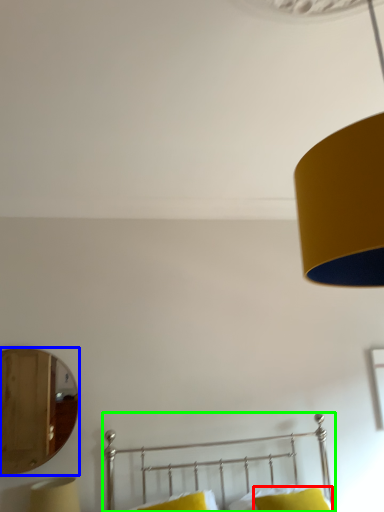
Question: Which is nearer to the pillow (highlighted by a red box)? mirror (highlighted by a blue box) or bed (highlighted by a green box).

Choices:
 (A) mirror
 (B) bed

Answer: (B)